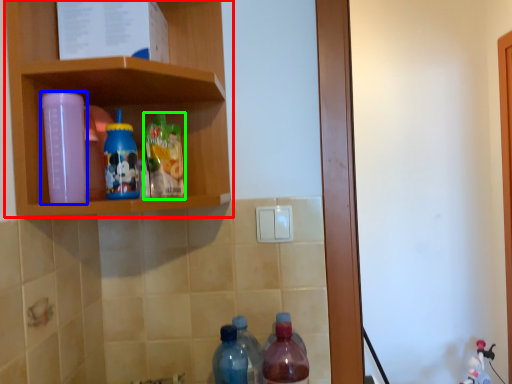
Question: Based on their relative distances, which object is nearer to shelf (highlighted by a red box)? Choose from bottle (highlighted by a blue box) and bottle (highlighted by a green box).

Choices:
 (A) bottle
 (B) bottle

Answer: (B)